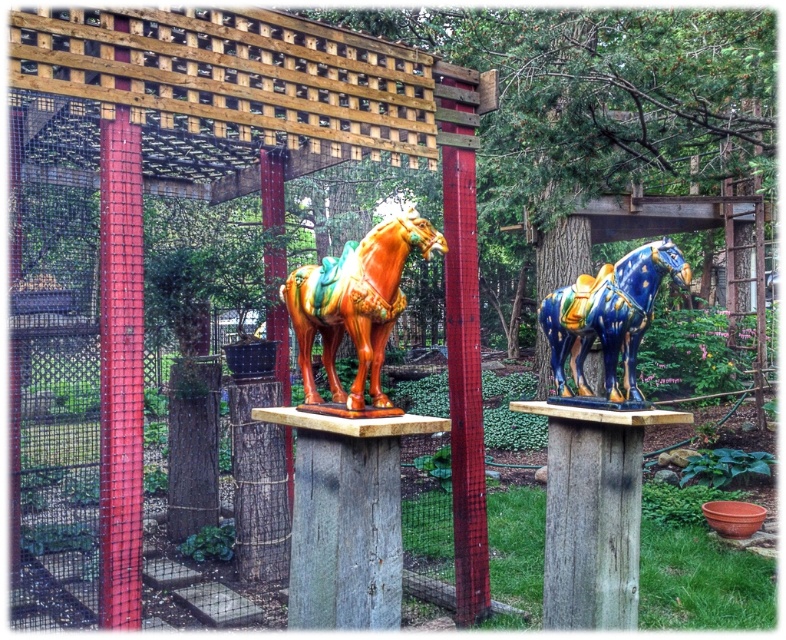
Is shiny orange horse at center shorter than blue glossy horse at center?

Incorrect, shiny orange horse at center's height does not fall short of blue glossy horse at center's.

Is shiny orange horse at center positioned before blue glossy horse at center?

Yes, it is in front of blue glossy horse at center.

This screenshot has height=640, width=786. I want to click on shiny orange horse at center, so click(x=355, y=305).

Locate an element on the screen. This screenshot has width=786, height=640. shiny orange horse at center is located at coordinates (355, 305).